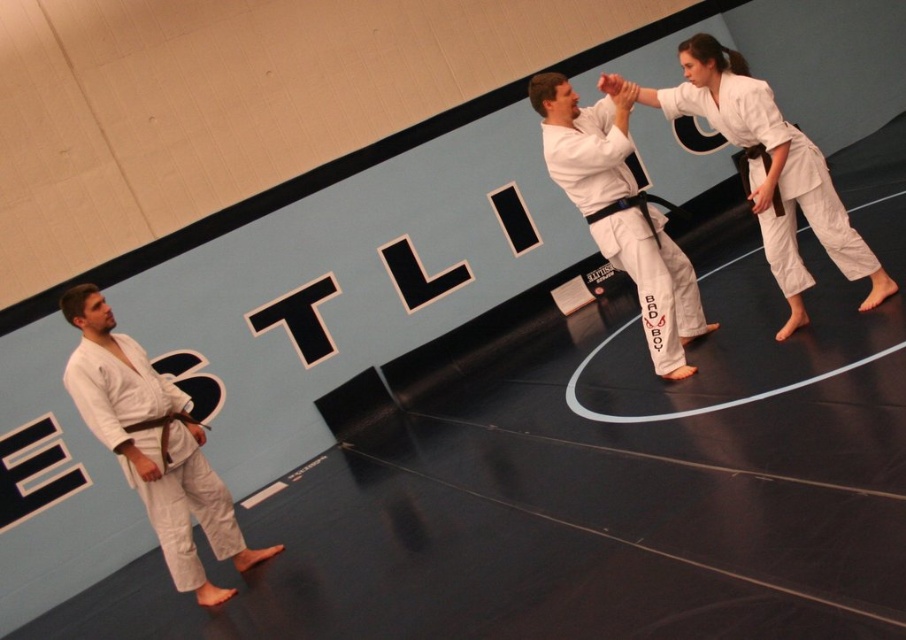
You are a new student entering the dojo and see the white karate uniform at center and the black leather belt at center. Which item is bigger in size?

The white karate uniform at center is larger in size compared to the black leather belt at center.

Based on the photo, you are a photographer positioned at the back of the dojo. You want to take a photo of both the white matte kimono at left and the white karate uniform at center without any obstructions. Based on their positions, which one should you adjust first to ensure both are fully visible in the frame?

The white matte kimono at left is in front of the white karate uniform at center. To ensure both are fully visible, you should adjust the white matte kimono at left first, moving it slightly backward or to the side so it doesn

You are a student in the dojo and need to retrieve your black leather belt at center from the floor. However, there is a white matte kimono at left in the way. Can you reach the belt without moving the kimono?

The white matte kimono at left is located below the black leather belt at center, so you can reach the belt without moving the kimono since it is positioned above it.